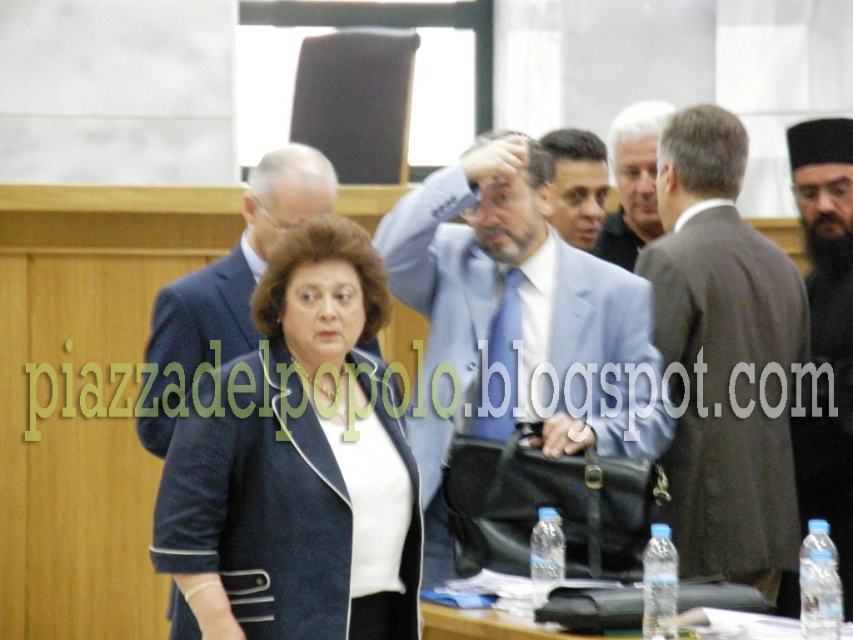
You are organizing a photo shoot and need to arrange two suits in the foreground of the image. The matte blue suit at center and the dark brown suit at center must be placed such that they don not overlap. Given their sizes, which suit should be placed further back to ensure they both fit in the frame?

The dark brown suit at center should be placed further back since it is smaller than the matte blue suit at center, allowing both suits to fit without overlapping.

You are standing in the courtroom and want to move from the point at coordinates point (436, 189) to the point at coordinates point (724, 250). Which direction should you move in to reach your destination?

You should move backward to reach point (724, 250) from point (436, 189) because point (436, 189) is in front of point (724, 250).